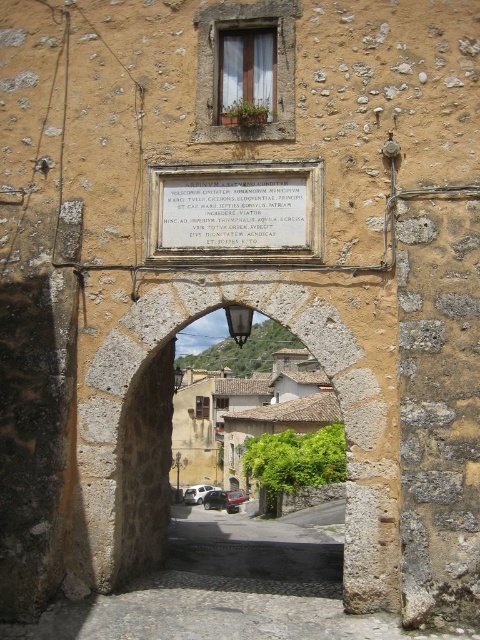
Question: Is stone archway at center smaller than white fabric window at upper center?

Choices:
 (A) yes
 (B) no

Answer: (B)

Question: Among these points, which one is nearest to the camera?

Choices:
 (A) (264, 244)
 (B) (239, 500)

Answer: (A)

Question: Which of the following is the closest to the observer?

Choices:
 (A) metallic silver car at center
 (B) stone archway at center

Answer: (B)

Question: Which object is the closest to the brown stone houses at center?

Choices:
 (A) white stone plaque at center
 (B) metallic silver car at center
 (C) white matte car at center
 (D) stone archway at center

Answer: (B)

Question: Is brown stone houses at center positioned at the back of white fabric window at upper center?

Choices:
 (A) yes
 (B) no

Answer: (A)

Question: Considering the relative positions of white stone plaque at center and white fabric window at upper center in the image provided, where is white stone plaque at center located with respect to white fabric window at upper center?

Choices:
 (A) left
 (B) right

Answer: (B)